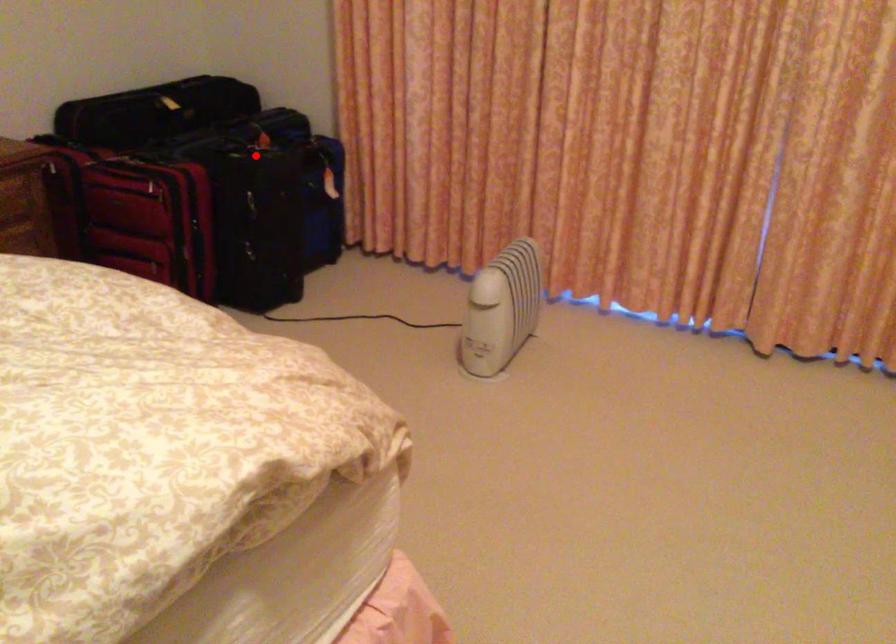
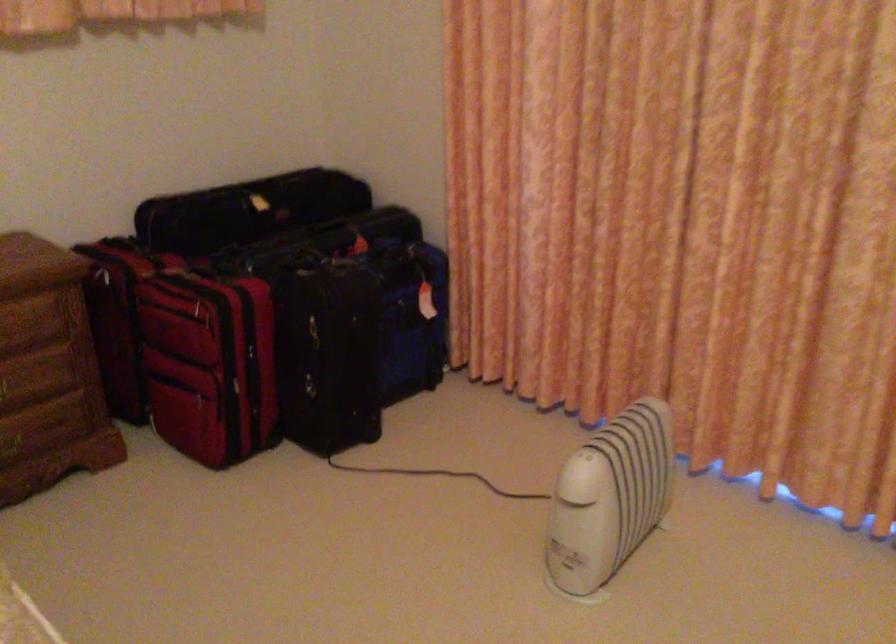
Question: I am providing you with two images of the same scene from different viewpoints. In image1, a red point is highlighted. Considering the same 3D point in image2, which of the following is correct?

Choices:
 (A) It is closer
 (B) It is farther

Answer: (A)